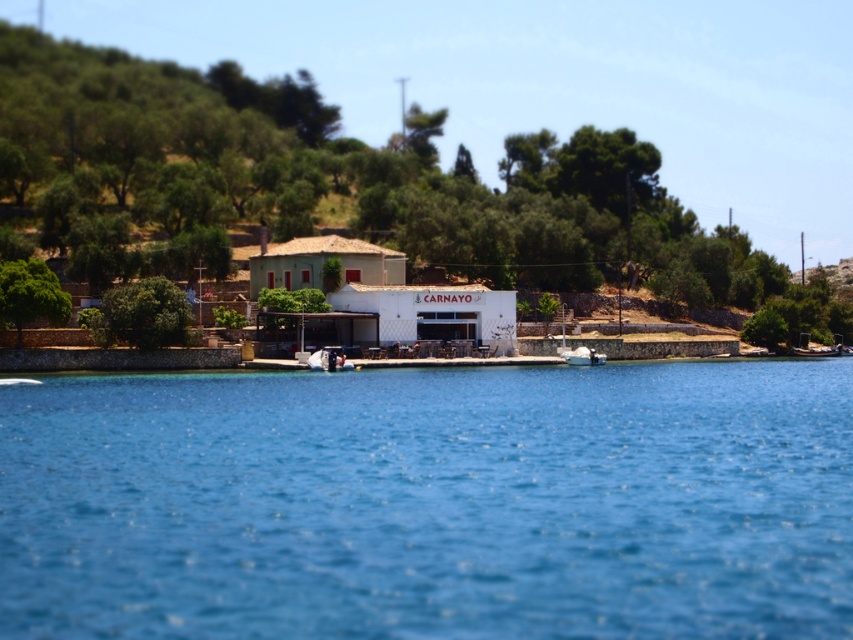
You are planning to place a new bench in the coastal scene so that it can be seen from both the blue water at center and the white matte boat at center. Where should you position the bench to ensure visibility from both locations?

The bench should be placed between the blue water at center and the white matte boat at center so that it is visible from both locations since the blue water at center is larger in size than the white matte boat at center, allowing for a clear line of sight.

You are standing at the point marked as point [431,502] in the image. What is the closest object to you in the scene?

The blue water at center is located at point [431,502], so you are standing in the blue water at center.

You are standing in the coastal scene and want to take a photo. There are two points of interest marked as point 1 at coordinates (753,547) and point 2 at coordinates (309,177). Which point should you focus on to ensure it appears larger in your photo?

Point 1 at coordinates (753,547) should be focused on because it is closer to the camera, making it appear larger in the photo compared to point 2 at coordinates (309,177).